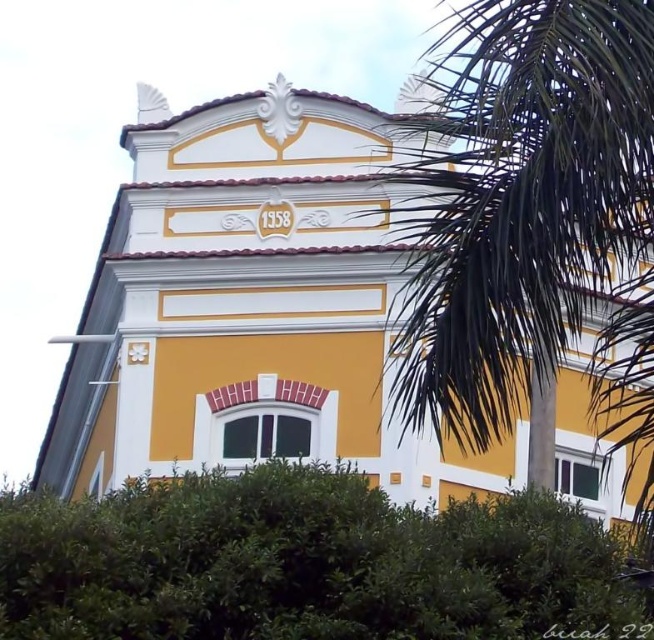
You are an architect visiting the building and want to take a photo of the yellow matte building at center and the green leafy palm tree at right. Which object should you focus on first if you want to capture both in a single frame without zooming in or out?

You should focus on the yellow matte building at center first because it is larger and more prominent than the green leafy palm tree at right, ensuring it remains the central subject while the palm tree can be included in the background or side.

You are standing in front of the yellow matte building at center and want to know if you can fit a green leafy palm tree at right next to it without overlapping. Based on their widths, can the palm tree be placed beside the building?

The yellow matte building at center is wider than the green leafy palm tree at right, so there is enough space to place the palm tree beside the building without overlapping.

You are standing in front of the building and want to take a photo that includes both point (477,240) and point (135,572). Which point should you focus on first to ensure both are in sharp focus?

You should focus on point (477,240) first because it is closer to the camera than point (135,572). This ensures the closer point is in focus, and the farther point will also be within the depth of field.